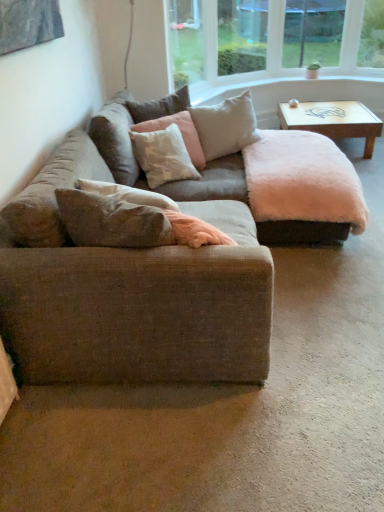
Find the location of a particular element. vacant area on top of wooden coffee table at upper right (from a real-world perspective) is located at coordinates (333, 116).